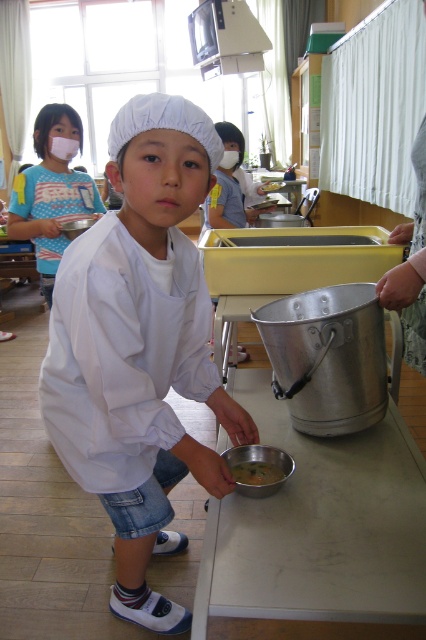
Question: Does white matte chef hat at center come in front of metallic silver bowl at lower center?

Choices:
 (A) yes
 (B) no

Answer: (A)

Question: Which object is farther from the camera taking this photo?

Choices:
 (A) metallic silver bowl at lower center
 (B) matte blue shirt at upper left
 (C) white matte chef hat at center

Answer: (A)

Question: Among these objects, which one is nearest to the camera?

Choices:
 (A) metallic silver bucket at right
 (B) metallic bowl at lower center
 (C) white matte chef hat at center

Answer: (C)

Question: Is metallic silver bucket at right thinner than yellow matte bowl at lower center?

Choices:
 (A) no
 (B) yes

Answer: (A)

Question: Which of the following is the closest to the observer?

Choices:
 (A) metallic bowl at lower center
 (B) metallic silver bucket at right
 (C) yellow matte bowl at lower center
 (D) white matte chef hat at center

Answer: (D)

Question: Can you confirm if white matte chef hat at center is positioned below metallic silver bowl at lower center?

Choices:
 (A) no
 (B) yes

Answer: (B)